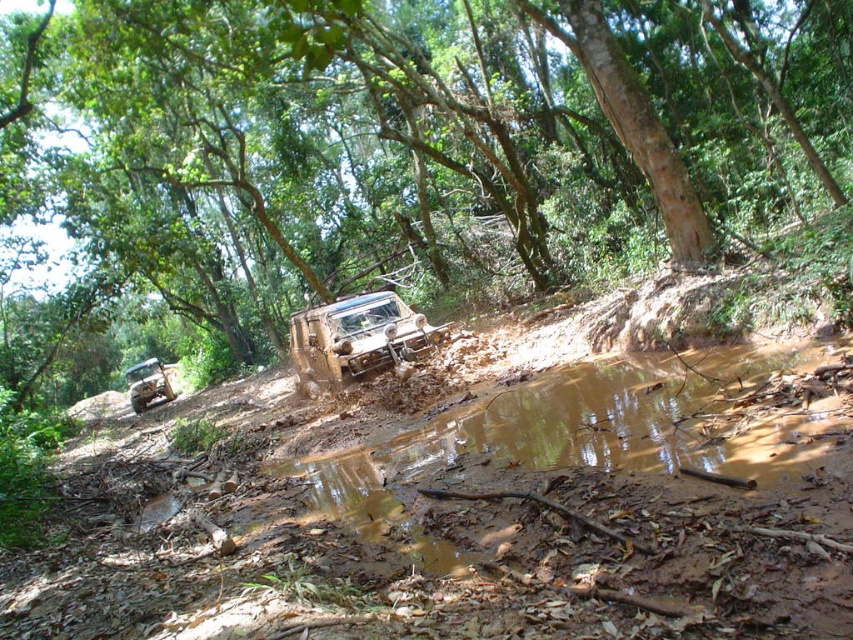
Question: Estimate the real-world distances between objects in this image. Which object is farther from the brown matte jeep at center?

Choices:
 (A) brushed metal jeep at lower left
 (B) brown muddy dirt track at center

Answer: (A)

Question: Is brown matte jeep at center above brushed metal jeep at lower left?

Choices:
 (A) no
 (B) yes

Answer: (B)

Question: Can you confirm if brown rough tree at upper center is thinner than brown muddy dirt track at center?

Choices:
 (A) no
 (B) yes

Answer: (A)

Question: Does brown rough tree at upper center have a larger size compared to brown matte jeep at center?

Choices:
 (A) yes
 (B) no

Answer: (A)

Question: Based on their relative distances, which object is farther from the brown rough tree at upper center?

Choices:
 (A) brown muddy dirt track at center
 (B) brown matte jeep at center

Answer: (B)

Question: Which of the following is the closest to the observer?

Choices:
 (A) brown muddy dirt track at center
 (B) brown matte jeep at center
 (C) brown rough tree at upper center
 (D) brushed metal jeep at lower left

Answer: (A)